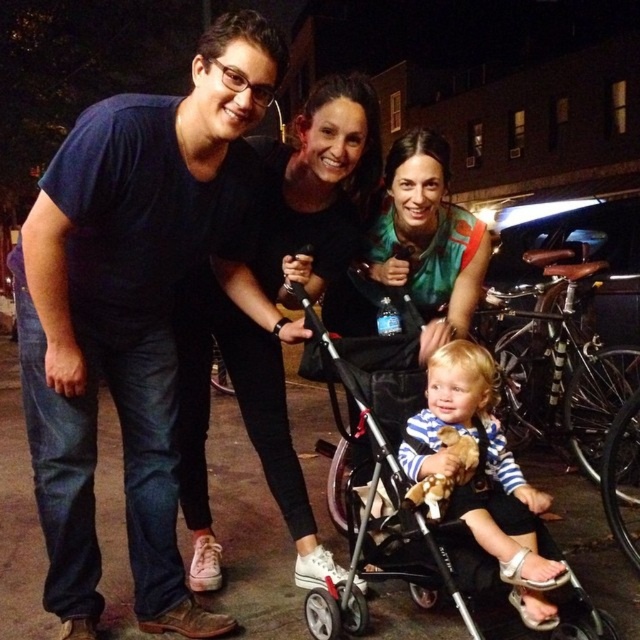
Question: Is black matte sneakers at lower center smaller than green matte shirt at center?

Choices:
 (A) yes
 (B) no

Answer: (B)

Question: Which object is farther from the camera taking this photo?

Choices:
 (A) green matte shirt at center
 (B) dark blue t-shirt at upper left
 (C) black matte sneakers at lower center
 (D) shiny black bicycle at right

Answer: (D)

Question: Estimate the real-world distances between objects in this image. Which object is closer to the black matte sneakers at lower center?

Choices:
 (A) dark blue t-shirt at upper left
 (B) black matte stroller at center
 (C) striped fabric baby at center

Answer: (B)

Question: Based on their relative distances, which object is nearer to the green matte shirt at center?

Choices:
 (A) shiny black bicycle at right
 (B) dark blue t-shirt at upper left
 (C) black matte stroller at center

Answer: (C)

Question: Is dark blue t-shirt at upper left to the right of black matte stroller at center from the viewer's perspective?

Choices:
 (A) yes
 (B) no

Answer: (B)

Question: Does dark blue t-shirt at upper left come in front of striped fabric baby at center?

Choices:
 (A) yes
 (B) no

Answer: (A)